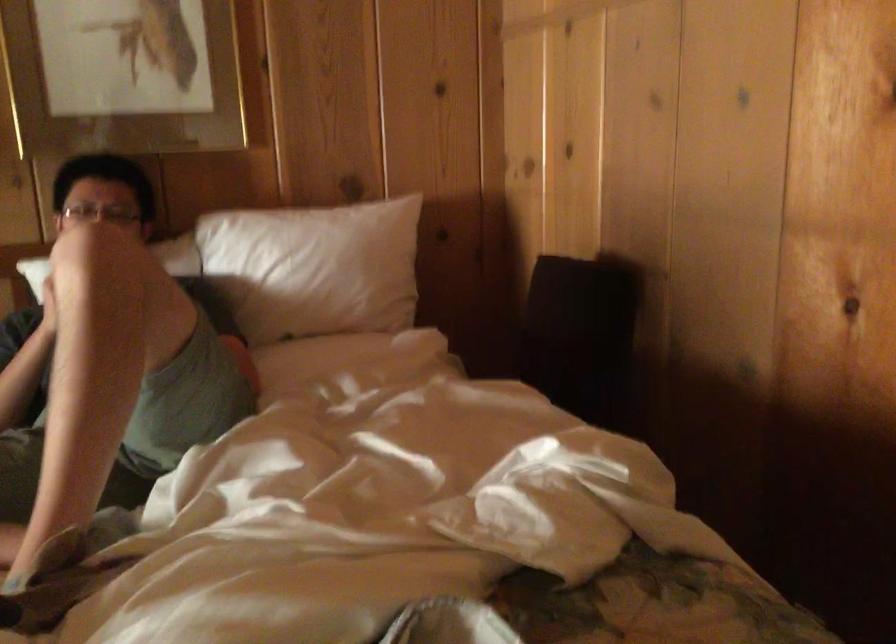
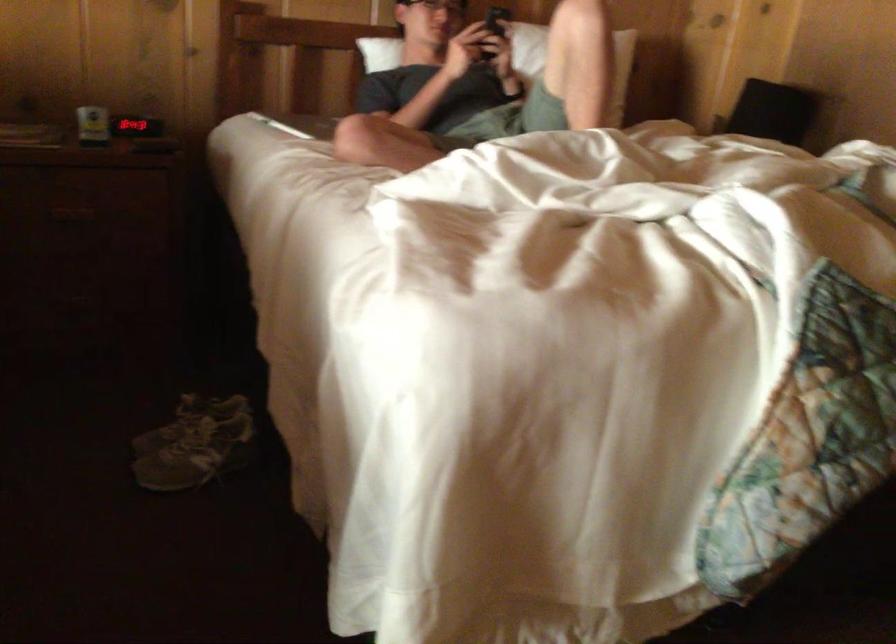
Find the pixel in the second image that matches [115,342] in the first image.

(573, 61)